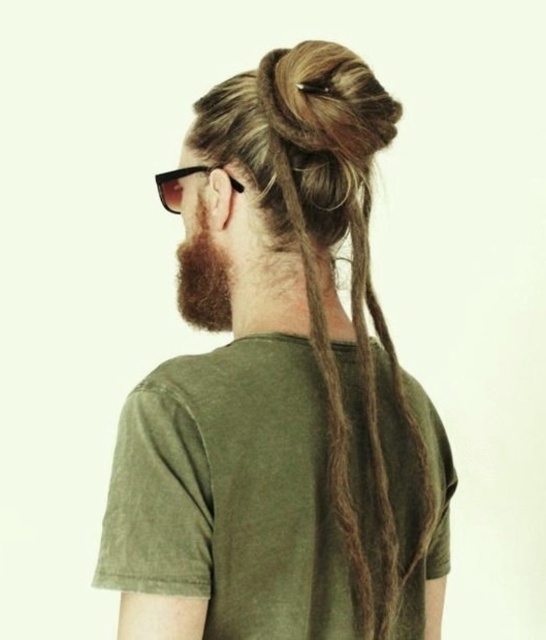
Please describe the position of the dark brown fuzzy beard at center in terms of coordinates within the image. The image has a coordinate system where the top left corner is the origin point. The x and y values range from 0 to 1, with 0 being the minimum and 1 being the maximum in each axis. The question must not mention the coordinate system details.

The dark brown fuzzy beard at center is located at coordinates approximately 0.438 on the x axis and 0.372 on the y axis.

In the scene shown: You are a photographer adjusting your camera settings to capture the subject in this image. You notice two points marked on the subject. The first point is at coordinates point (340, 588) and the second is at point (191, 173). Which point should you focus on to ensure it appears sharp in the final photo if you want the closest point to the camera to be in focus?

You should focus on point (340, 588) because it is closer to the camera than point (191, 173), so it will appear sharp in the final photo.

You are an artist trying to sketch the person in the image. The person has brown matte hair at upper center. To ensure accuracy, where should you place this hair relative to the center of the image?

The brown matte hair at upper center should be placed at the coordinates point (282, 396) relative to the center of the image.